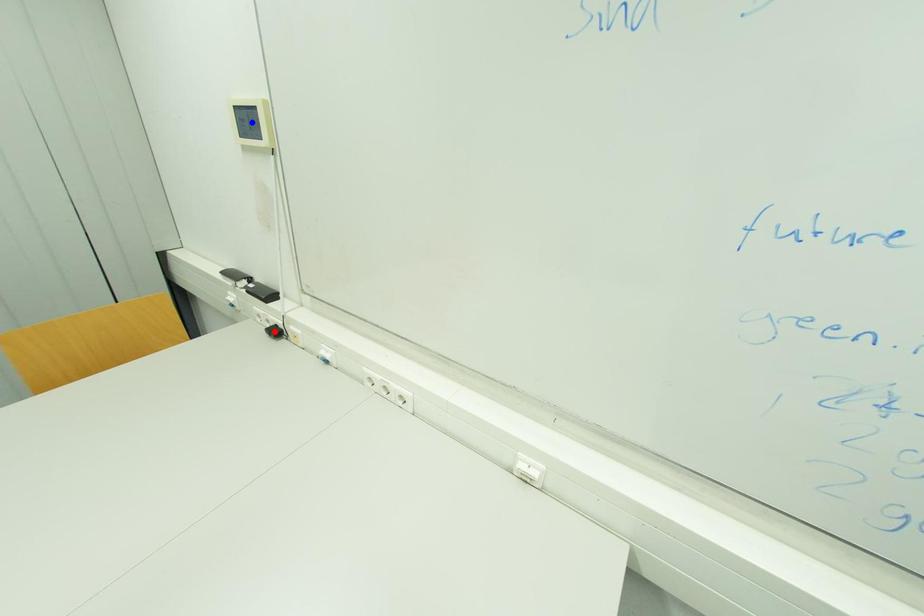
Question: Two points are marked on the image. Which point is closer to the camera?

Choices:
 (A) Blue point is closer.
 (B) Red point is closer.

Answer: (A)